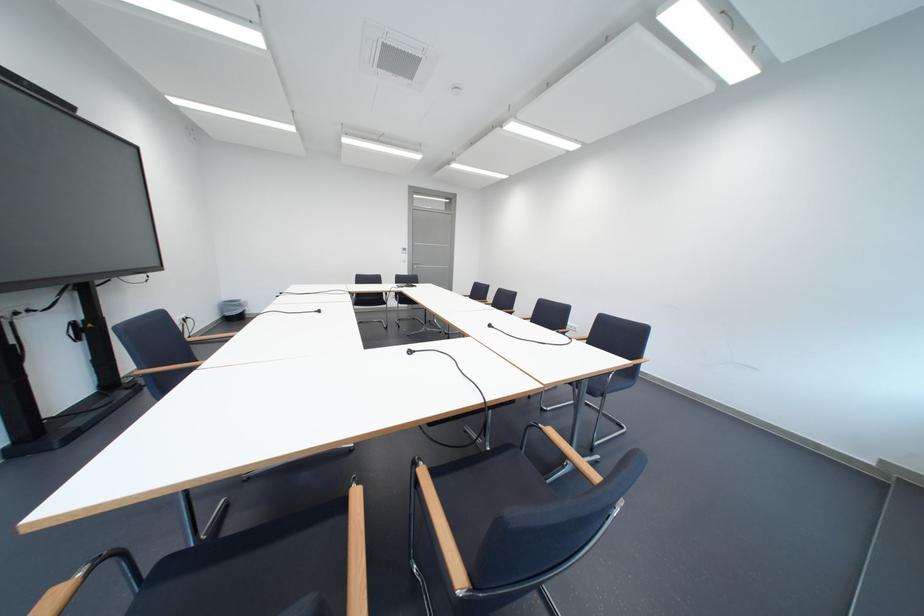
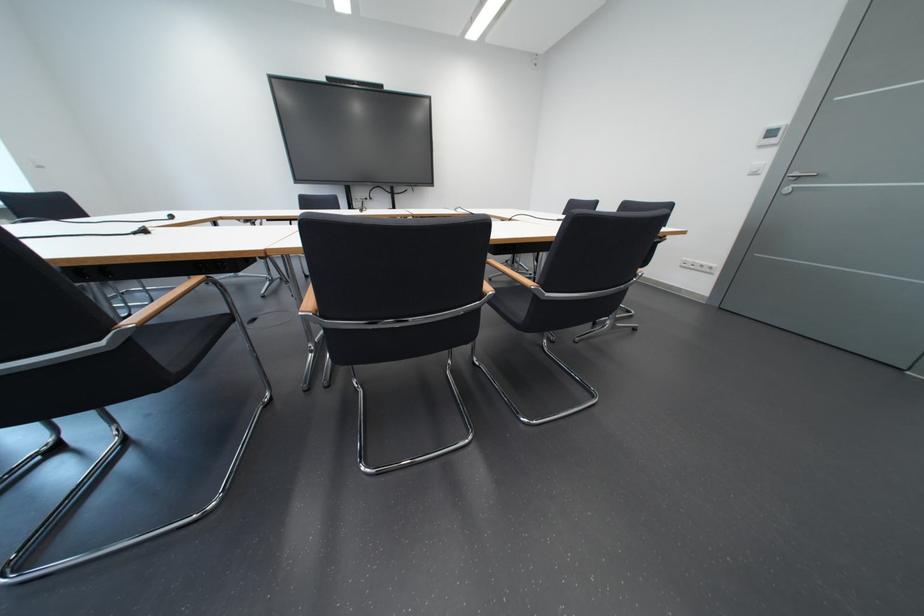
Question: I am providing you with two images of the same scene from different viewpoints. Which of the following objects are not visible in image2?

Choices:
 (A) chair sitting surface
 (B) media cabinet handle
 (C) silver door handle
 (D) white light switch

Answer: (A)